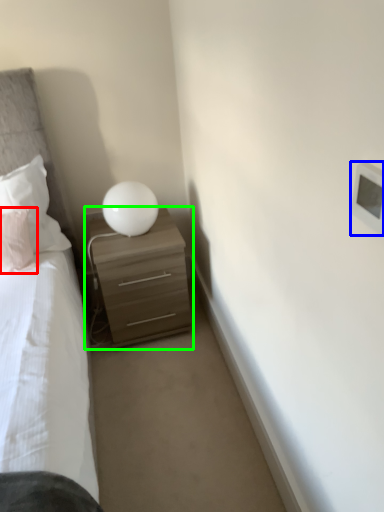
Question: Considering the real-world distances, which object is closest to pillow (highlighted by a red box)? light switch (highlighted by a blue box) or nightstand (highlighted by a green box).

Choices:
 (A) light switch
 (B) nightstand

Answer: (B)